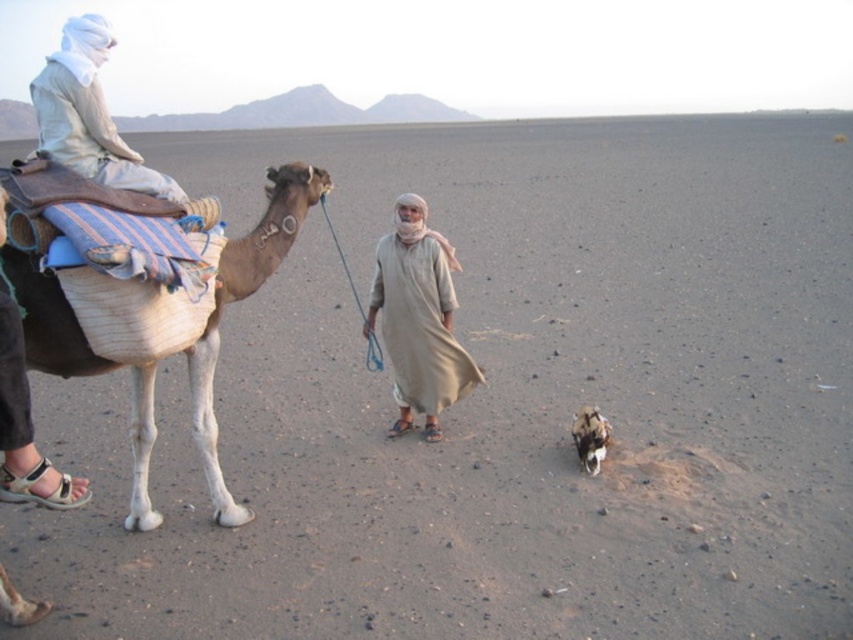
Question: Which of the following is the closest to the observer?

Choices:
 (A) (61, 506)
 (B) (440, 282)
 (C) (401, 420)
 (D) (219, 497)

Answer: (A)

Question: Is white cotton headscarf at upper left behind brown leather sandal at lower left?

Choices:
 (A) no
 (B) yes

Answer: (B)

Question: Based on their relative distances, which object is nearer to the brown leather sandal at lower center?

Choices:
 (A) white cotton headscarf at upper left
 (B) spotted fur camel at lower right
 (C) brown leather sandal at lower left

Answer: (B)

Question: Does beige cotton robe at center appear over spotted fur camel at lower right?

Choices:
 (A) yes
 (B) no

Answer: (A)

Question: Is white cotton headscarf at upper left wider than spotted fur camel at lower right?

Choices:
 (A) no
 (B) yes

Answer: (B)

Question: Estimate the real-world distances between objects in this image. Which object is farther from the beige cotton robe at center?

Choices:
 (A) brown leather sandal at lower left
 (B) brown leather sandal at center

Answer: (A)